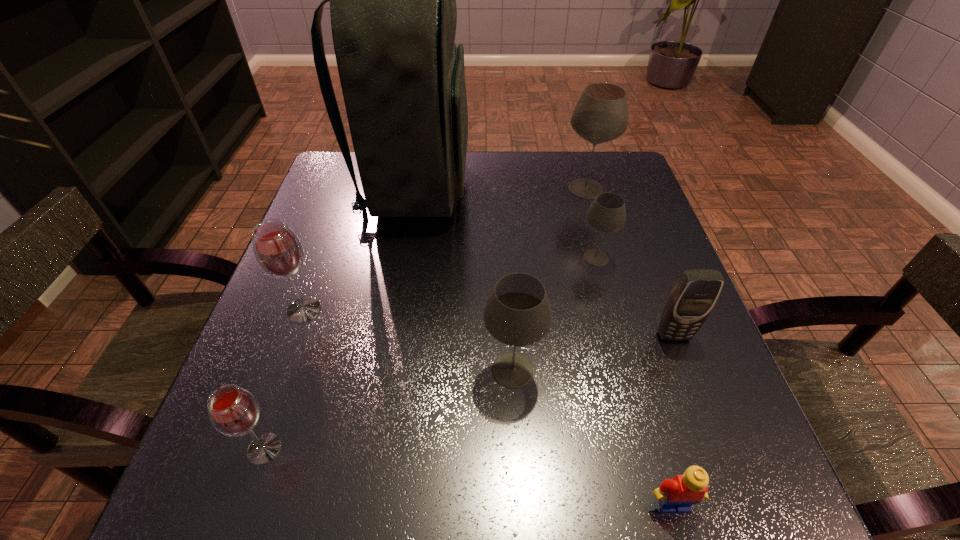
The width and height of the screenshot is (960, 540). Find the location of `the nearest wineglass`. the nearest wineglass is located at coordinates (233, 411).

The width and height of the screenshot is (960, 540). I want to click on the smallest gray wineglass, so click(x=607, y=213).

Identify the location of the second farthest gray wineglass. (607, 213).

Where is `the nearest object`? The width and height of the screenshot is (960, 540). the nearest object is located at coordinates (674, 495).

Find the location of a particular element. the shortest object is located at coordinates (674, 495).

In order to click on free region located 0.390m on the front-facing side of the backpack in this screenshot , I will do `click(620, 188)`.

You are a GUI agent. You are given a task and a screenshot of the screen. Output one action in this format:
    pyautogui.click(x=<x>, y=<y>)
    Task: Click on the vacant space located 0.200m on the left of the biggest gray wineglass
    Image resolution: width=960 pixels, height=540 pixels.
    Given the screenshot: What is the action you would take?
    pyautogui.click(x=483, y=189)

Find the location of a particular element. free space located 0.220m on the right of the third nearest wineglass is located at coordinates (437, 310).

Locate an element on the screen. vacant region located 0.230m on the left of the third wineglass from right to left is located at coordinates (349, 370).

This screenshot has height=540, width=960. Identify the location of vacant area situated 0.160m on the front face of the fourth nearest object. (708, 427).